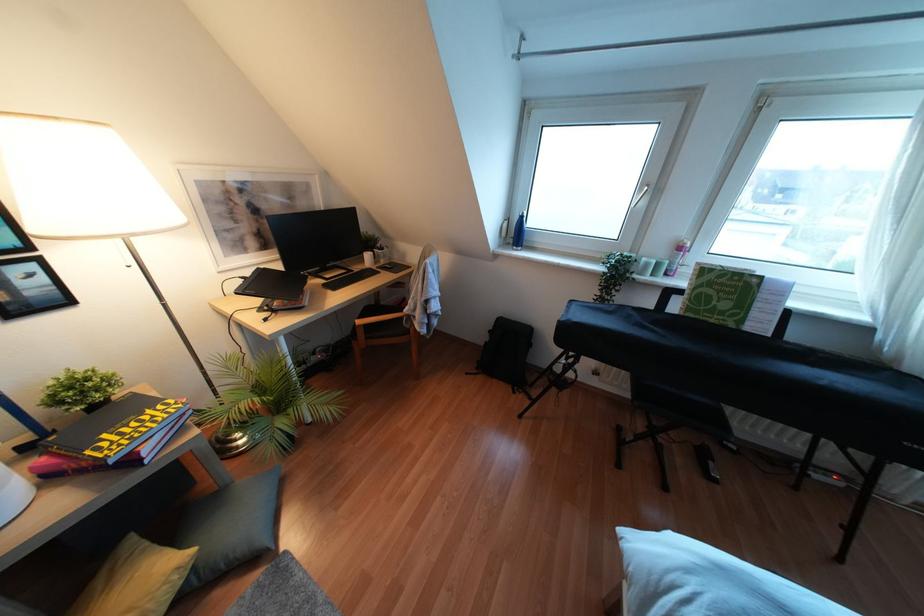
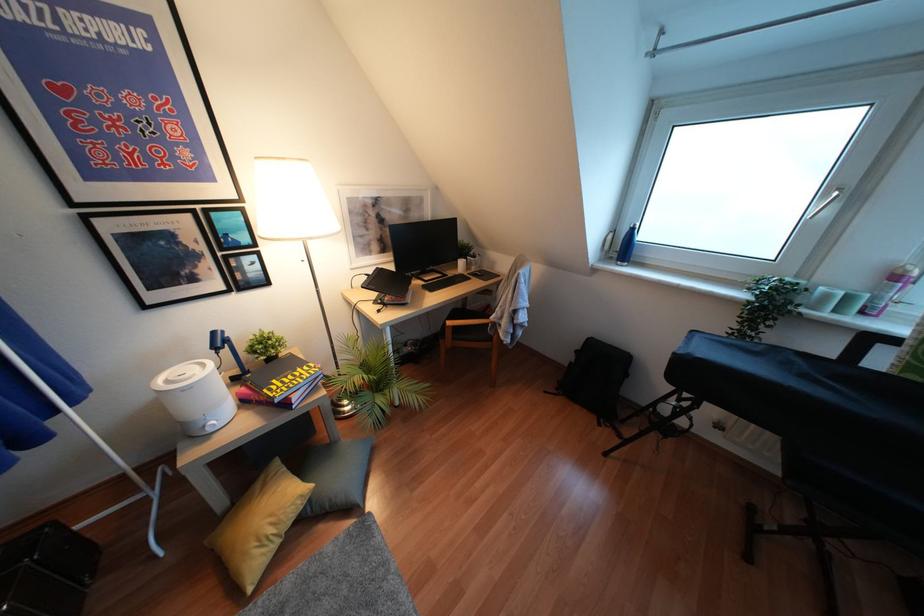
Find the pixel in the second image that matches point (516, 233) in the first image.

(623, 246)